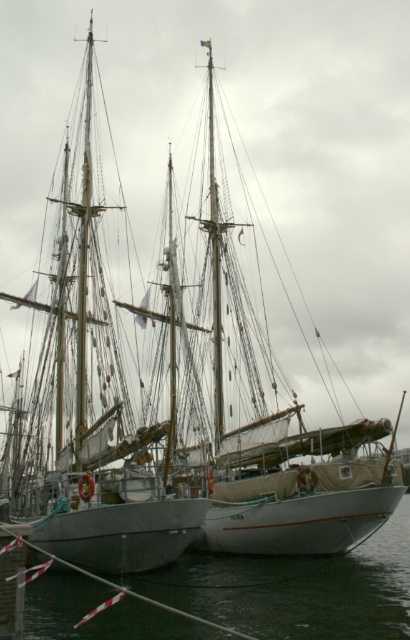
Question: Is wooden sailboat at left smaller than black rubber water at lower center?

Choices:
 (A) yes
 (B) no

Answer: (B)

Question: Is wooden sailboat at left to the left of black rubber water at lower center from the viewer's perspective?

Choices:
 (A) yes
 (B) no

Answer: (A)

Question: Among these points, which one is nearest to the camera?

Choices:
 (A) (257, 588)
 (B) (129, 442)

Answer: (B)

Question: Which of the following is the farthest from the observer?

Choices:
 (A) (134, 602)
 (B) (72, 157)

Answer: (B)

Question: In this image, where is wooden sailboat at left located relative to black rubber water at lower center?

Choices:
 (A) above
 (B) below

Answer: (A)